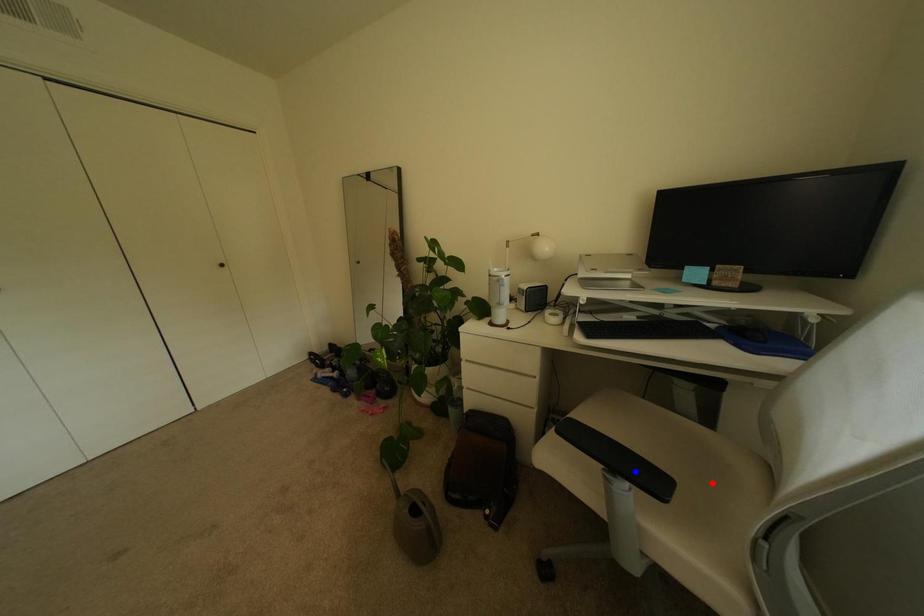
Question: Which of the two points in the image is closer to the camera?

Choices:
 (A) Blue point is closer.
 (B) Red point is closer.

Answer: (B)